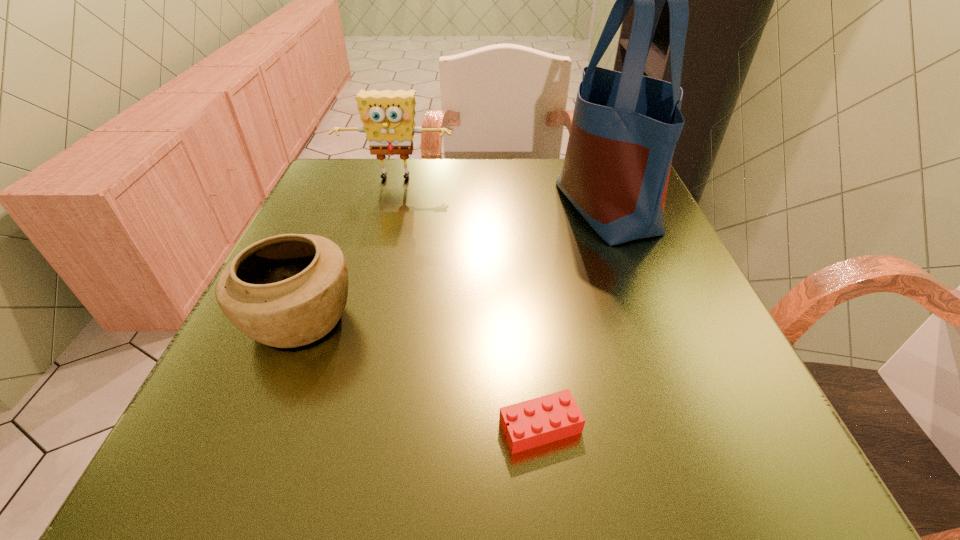
Locate an element on the screen. This screenshot has height=540, width=960. free spot between the third shortest object and the nearest object is located at coordinates (468, 303).

You are a GUI agent. You are given a task and a screenshot of the screen. Output one action in this format:
    pyautogui.click(x=<x>, y=<y>)
    Task: Click on the blank region between the handbag and the third shortest object
    The image size is (960, 540).
    Given the screenshot: What is the action you would take?
    pyautogui.click(x=501, y=193)

In order to click on free spot between the Lego and the sponge in this screenshot , I will do `click(468, 303)`.

Identify the location of vacant space that's between the handbag and the second tallest object. The image size is (960, 540). (501, 193).

Where is `unoccupied area between the third shortest object and the tallest object`? The width and height of the screenshot is (960, 540). unoccupied area between the third shortest object and the tallest object is located at coordinates (501, 193).

You are a GUI agent. You are given a task and a screenshot of the screen. Output one action in this format:
    pyautogui.click(x=<x>, y=<y>)
    Task: Click on the closest object to the nearest object
    The width and height of the screenshot is (960, 540).
    Given the screenshot: What is the action you would take?
    pyautogui.click(x=285, y=291)

Locate which object ranks third in proximity to the handbag. Please provide its 2D coordinates. Your answer should be formatted as a tuple, i.e. [(x, y)], where the tuple contains the x and y coordinates of a point satisfying the conditions above.

[(285, 291)]

Identify the location of vacant space that satisfies the following two spatial constraints: 1. on the face of the handbag; 2. on the right side of the sponge. This screenshot has height=540, width=960. (388, 207).

In order to click on vacant area that satisfies the following two spatial constraints: 1. on the front side of the pottery; 2. on the left side of the nearest object in this screenshot , I will do `click(255, 427)`.

At what (x,y) coordinates should I click in order to perform the action: click on free location that satisfies the following two spatial constraints: 1. on the face of the handbag; 2. on the right side of the sponge. Please return your answer as a coordinate pair (x, y). Image resolution: width=960 pixels, height=540 pixels. Looking at the image, I should click on (388, 207).